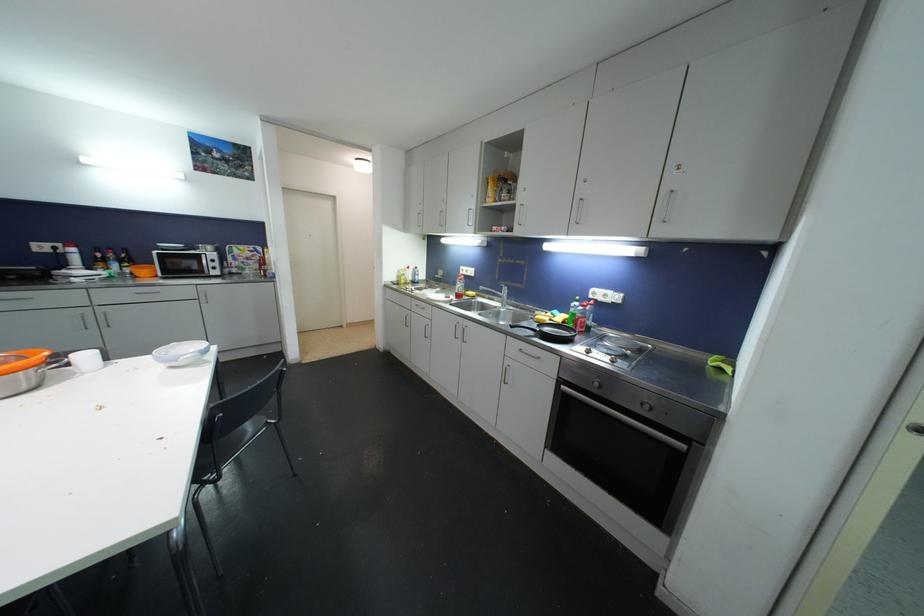
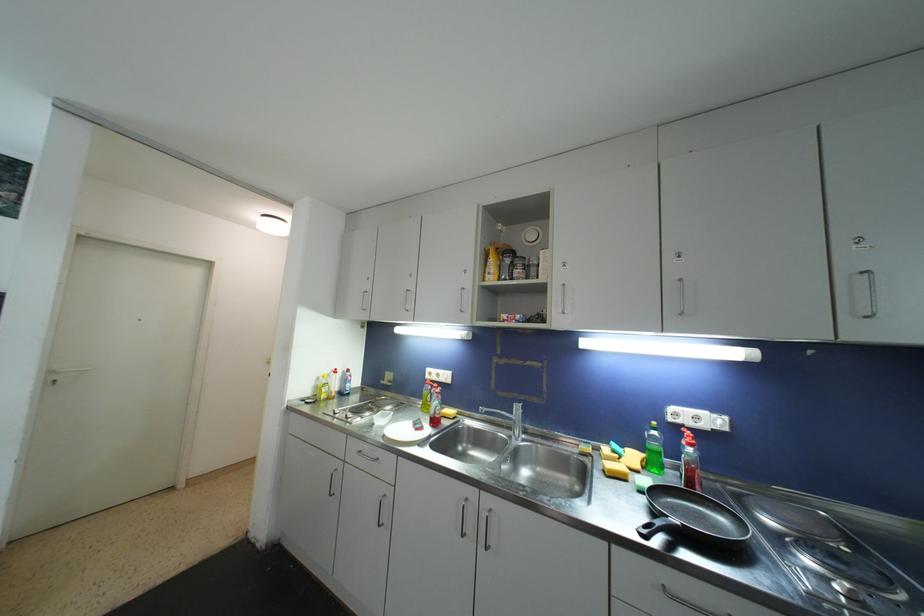
Find the pixel in the second image that matches pixel 507 293 in the first image.

(520, 411)